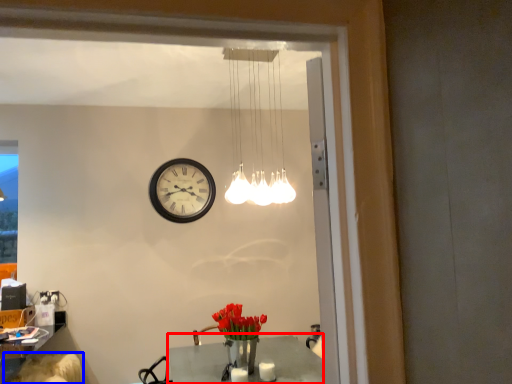
Question: Which point is further to the camera, table (highlighted by a red box) or swivel chair (highlighted by a blue box)?

Choices:
 (A) table
 (B) swivel chair

Answer: (B)